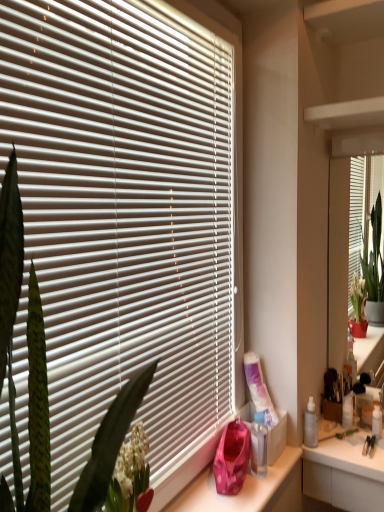
Question: Considering the relative positions of green leafy plant at left and translucent plastic spray bottle at right, which is counted as the first toiletry, starting from the left, in the image provided, is green leafy plant at left in front of translucent plastic spray bottle at right, which is counted as the first toiletry, starting from the left,?

Choices:
 (A) yes
 (B) no

Answer: (A)

Question: Does green leafy plant at left have a greater width compared to translucent plastic spray bottle at right, which is counted as the first toiletry, starting from the left?

Choices:
 (A) no
 (B) yes

Answer: (B)

Question: Is green leafy plant at left outside of translucent plastic spray bottle at right, which is counted as the first toiletry, starting from the left?

Choices:
 (A) no
 (B) yes

Answer: (B)

Question: Is green leafy plant at left taller than translucent plastic spray bottle at right, which is the second toiletry from right to left?

Choices:
 (A) yes
 (B) no

Answer: (A)

Question: From a real-world perspective, is green leafy plant at left located beneath translucent plastic spray bottle at right, the first toiletry positioned from the front?

Choices:
 (A) no
 (B) yes

Answer: (A)

Question: Is green leafy plant at left thinner than translucent plastic spray bottle at right, which is counted as the first toiletry, starting from the left?

Choices:
 (A) yes
 (B) no

Answer: (B)

Question: Does clear plastic bottle at lower right have a larger size compared to matte white mirror at right?

Choices:
 (A) no
 (B) yes

Answer: (A)

Question: Are clear plastic bottle at lower right and matte white mirror at right beside each other?

Choices:
 (A) yes
 (B) no

Answer: (B)

Question: From the image's perspective, is clear plastic bottle at lower right below matte white mirror at right?

Choices:
 (A) yes
 (B) no

Answer: (A)

Question: Considering the relative sizes of clear plastic bottle at lower right and matte white mirror at right in the image provided, is clear plastic bottle at lower right wider than matte white mirror at right?

Choices:
 (A) no
 (B) yes

Answer: (B)

Question: Are clear plastic bottle at lower right and matte white mirror at right located far from each other?

Choices:
 (A) no
 (B) yes

Answer: (A)

Question: Considering the relative positions of clear plastic bottle at lower right and matte white mirror at right in the image provided, is clear plastic bottle at lower right to the right of matte white mirror at right from the viewer's perspective?

Choices:
 (A) no
 (B) yes

Answer: (A)

Question: Would you say green leafy plant at left contains matte white mirror at right?

Choices:
 (A) yes
 (B) no

Answer: (B)